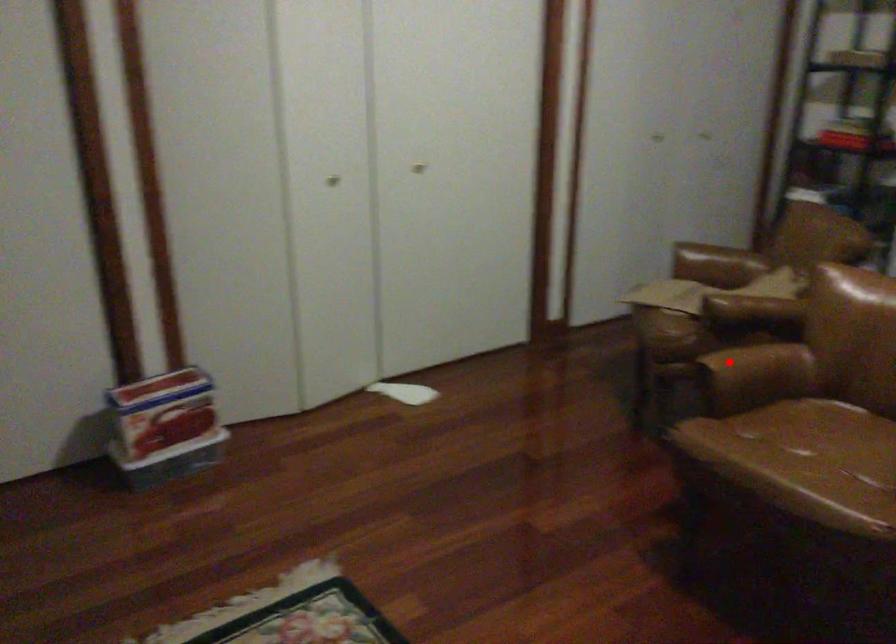
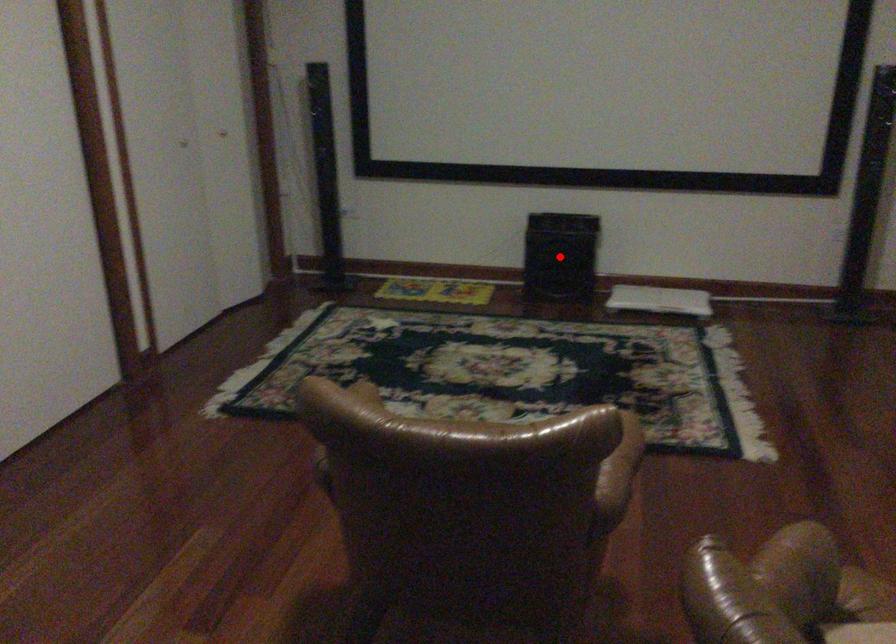
I am providing you with two images of the same scene from different viewpoints. A red point is marked on the first image and another point is marked on the second image. Are the points marked in image1 and image2 representing the same 3D position?

No